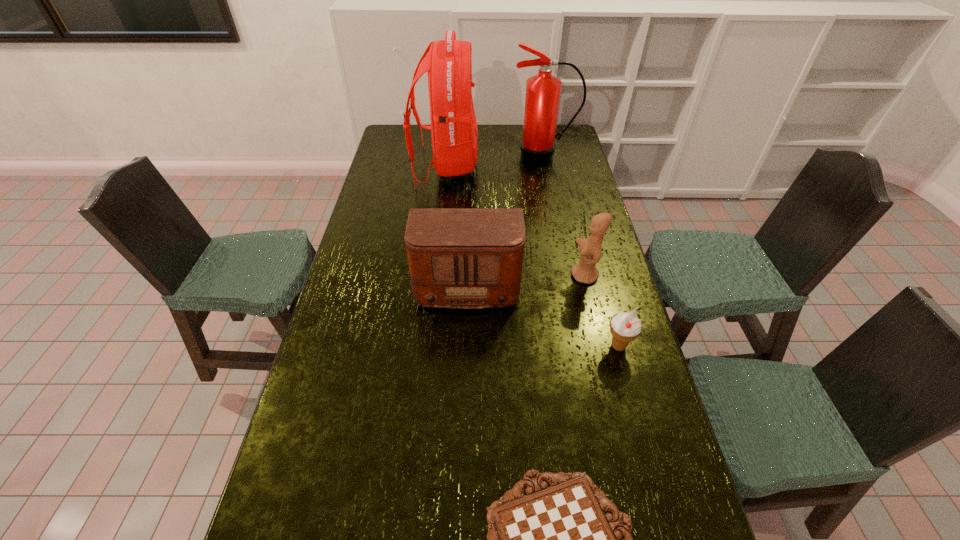
You are a GUI agent. You are given a task and a screenshot of the screen. Output one action in this format:
    pyautogui.click(x=<x>, y=<y>)
    Task: Click on the backpack
    
    Given the screenshot: What is the action you would take?
    pyautogui.click(x=454, y=132)

You are a GUI agent. You are given a task and a screenshot of the screen. Output one action in this format:
    pyautogui.click(x=<x>, y=<y>)
    Task: Click on the fire extinguisher
    
    Given the screenshot: What is the action you would take?
    pyautogui.click(x=537, y=146)

The width and height of the screenshot is (960, 540). Find the location of `radio receiver`. radio receiver is located at coordinates (466, 258).

The image size is (960, 540). Identify the location of figurine. (590, 249).

The width and height of the screenshot is (960, 540). Find the location of `the second nearest object`. the second nearest object is located at coordinates (625, 327).

I want to click on icecream, so click(x=625, y=327).

Locate an element on the screen. vacant space located on the main compartment of the backpack is located at coordinates (544, 166).

The width and height of the screenshot is (960, 540). In order to click on free location located at the spray nozzle of the fire extinguisher in this screenshot , I will do `click(555, 212)`.

You are a GUI agent. You are given a task and a screenshot of the screen. Output one action in this format:
    pyautogui.click(x=<x>, y=<y>)
    Task: Click on the free space located on the front panel of the radio receiver
    The height and width of the screenshot is (540, 960).
    Given the screenshot: What is the action you would take?
    pyautogui.click(x=467, y=330)

Identify the location of free space located 0.360m on the front-facing side of the figurine. The height and width of the screenshot is (540, 960). (465, 276).